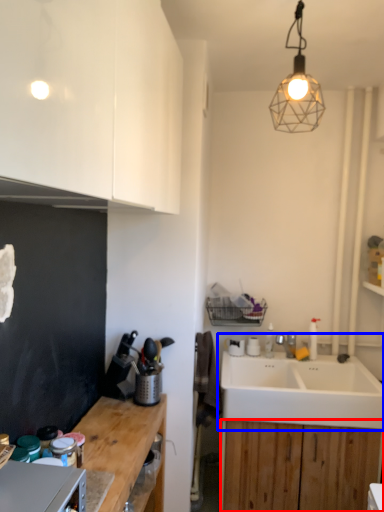
Question: Which of the following is the closest to the observer, cabinetry (highlighted by a red box) or sink (highlighted by a blue box)?

Choices:
 (A) cabinetry
 (B) sink

Answer: (B)